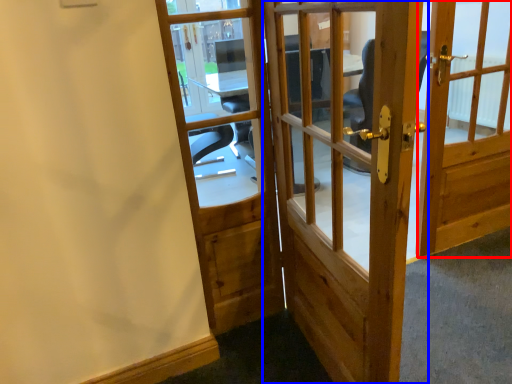
Question: Which object is closer to the camera taking this photo, door (highlighted by a red box) or door (highlighted by a blue box)?

Choices:
 (A) door
 (B) door

Answer: (B)